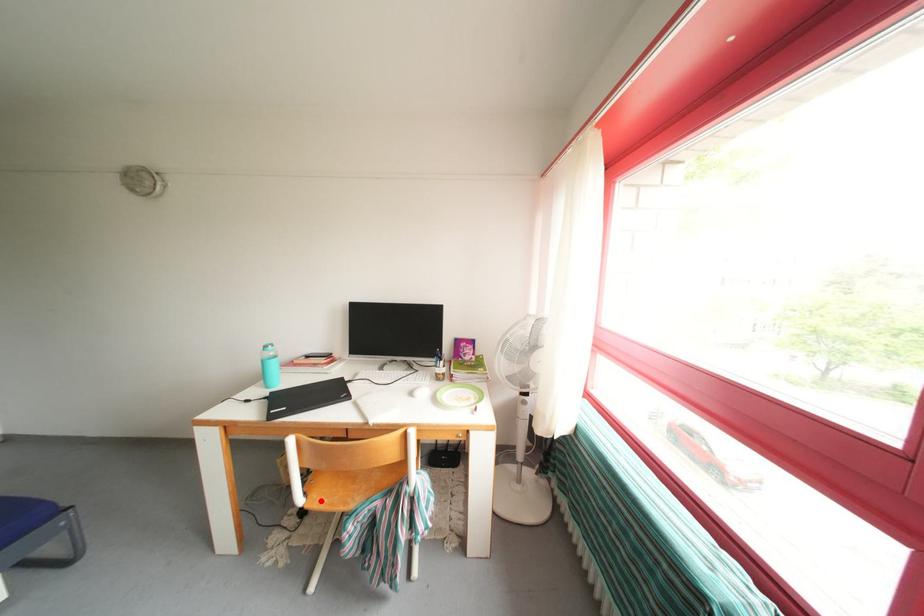
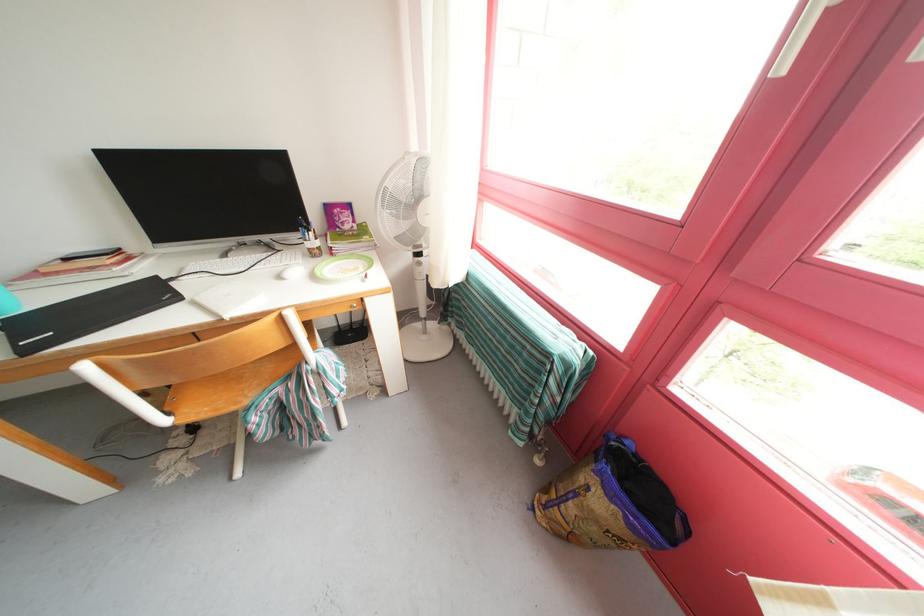
Locate, in the second image, the point that corresponds to the highlighted location in the first image.

(191, 416)